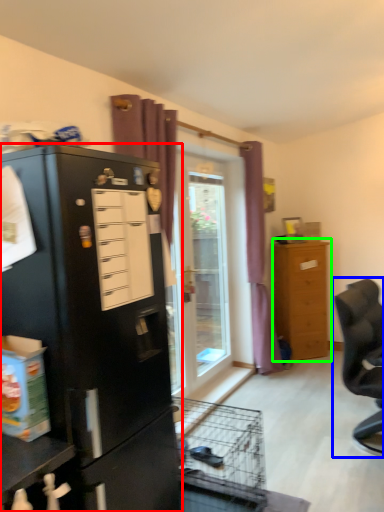
Question: Based on their relative distances, which object is farther from cupboard (highlighted by a red box)? Choose from chair (highlighted by a blue box) and chest of drawers (highlighted by a green box).

Choices:
 (A) chair
 (B) chest of drawers

Answer: (B)